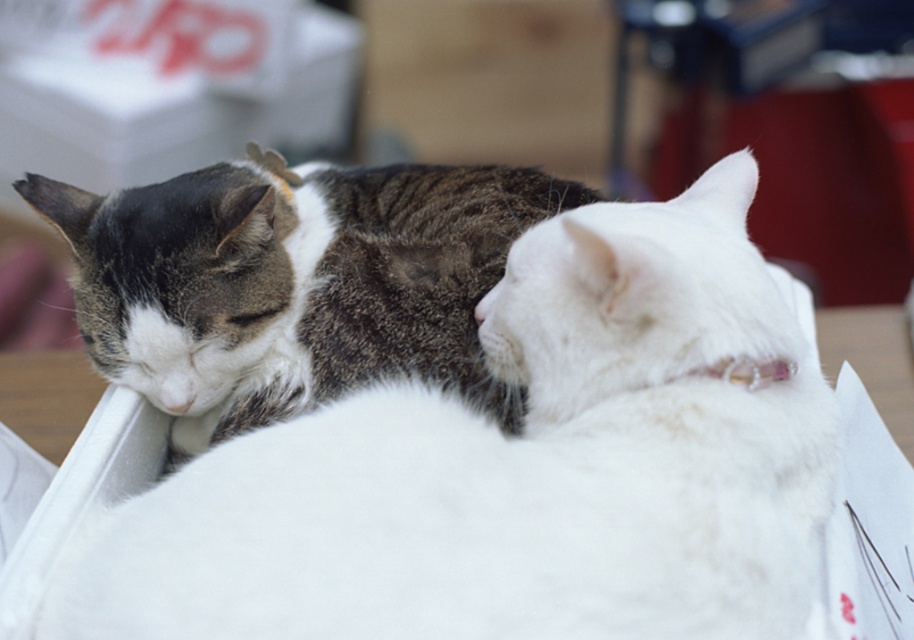
Does white fluffy cat at center have a lesser height compared to tabby fur cat at left?

In fact, white fluffy cat at center may be taller than tabby fur cat at left.

Who is more distant from viewer, (311, 547) or (444, 173)?

Point (444, 173)

Is point (156, 586) closer to camera compared to point (385, 262)?

That is True.

Image resolution: width=914 pixels, height=640 pixels. Find the location of `white fluffy cat at center`. white fluffy cat at center is located at coordinates (515, 468).